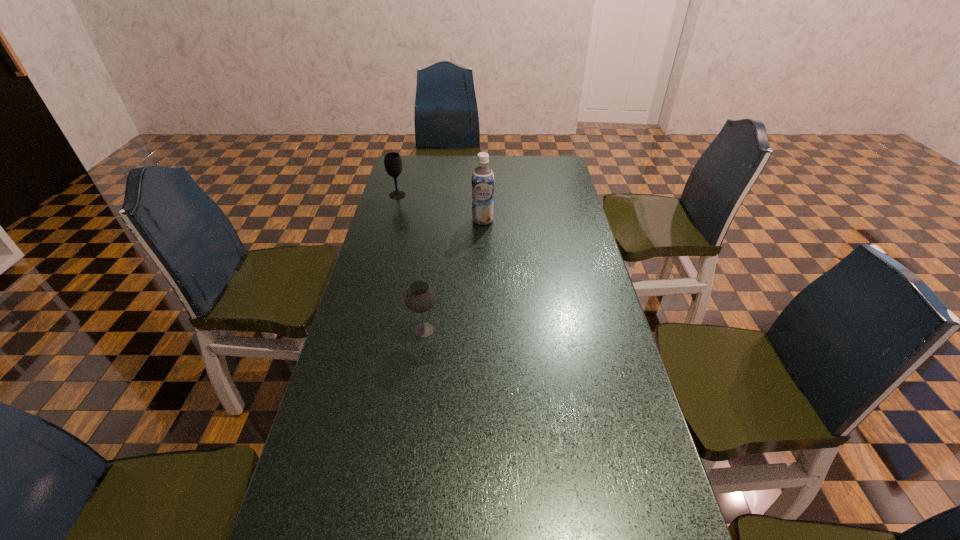
Locate an element on the screen. The height and width of the screenshot is (540, 960). empty location between the second nearest object and the left wineglass is located at coordinates (440, 207).

At what (x,y) coordinates should I click in order to perform the action: click on unoccupied area between the left wineglass and the nearer wineglass. Please return your answer as a coordinate pair (x, y). The width and height of the screenshot is (960, 540). Looking at the image, I should click on (411, 262).

Locate an element on the screen. Image resolution: width=960 pixels, height=540 pixels. vacant area between the nearest object and the leftmost object is located at coordinates (411, 262).

Locate an element on the screen. This screenshot has width=960, height=540. free spot between the second farthest object and the second object from right to left is located at coordinates (453, 275).

Image resolution: width=960 pixels, height=540 pixels. I want to click on object that is the second closest one to the farthest object, so click(419, 298).

Where is `object that can be found as the closest to the second farthest object`? object that can be found as the closest to the second farthest object is located at coordinates (392, 161).